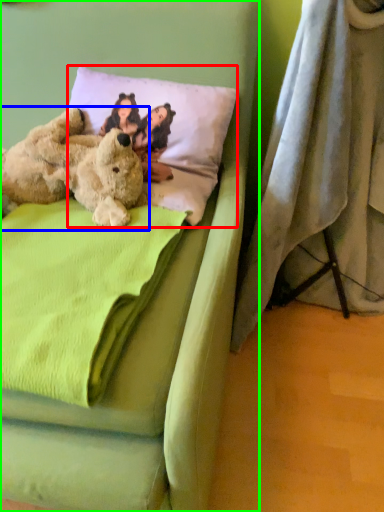
Question: Which is farther away from pillow (highlighted by a red box)? teddy bear (highlighted by a blue box) or bed (highlighted by a green box)?

Choices:
 (A) teddy bear
 (B) bed

Answer: (B)